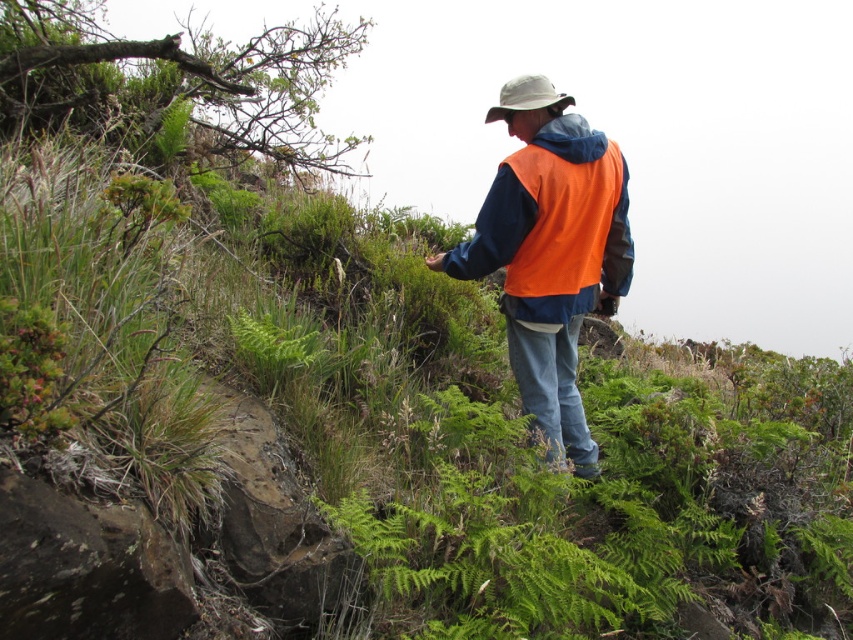
Question: Which of the following is the closest to the observer?

Choices:
 (A) khaki fabric hat at center
 (B) orange fleece vest at center

Answer: (B)

Question: Considering the relative positions of orange fleece vest at center and khaki fabric hat at center in the image provided, where is orange fleece vest at center located with respect to khaki fabric hat at center?

Choices:
 (A) above
 (B) below

Answer: (B)

Question: Can you confirm if orange fleece vest at center is positioned to the right of khaki fabric hat at center?

Choices:
 (A) yes
 (B) no

Answer: (A)

Question: Which point is closer to the camera?

Choices:
 (A) (552, 152)
 (B) (540, 97)

Answer: (A)

Question: From the image, what is the correct spatial relationship of orange fleece vest at center in relation to khaki fabric hat at center?

Choices:
 (A) above
 (B) below

Answer: (B)